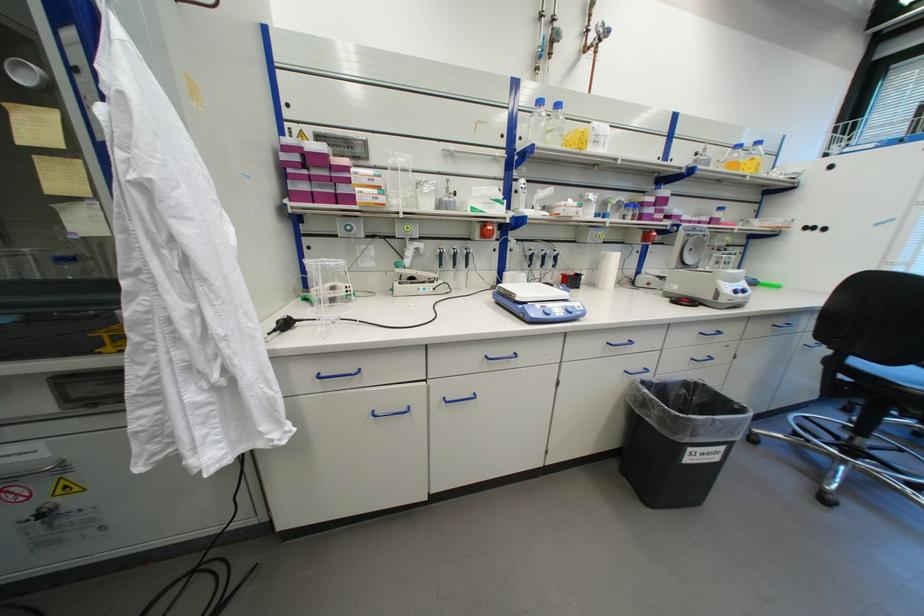
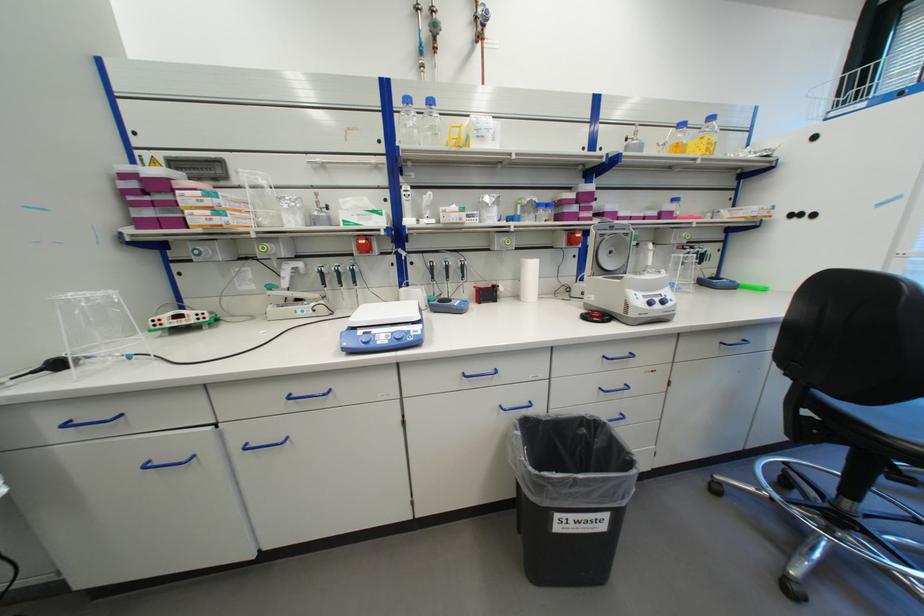
Find the pixel in the second image that matches the point at 698,450 in the first image.

(565, 517)